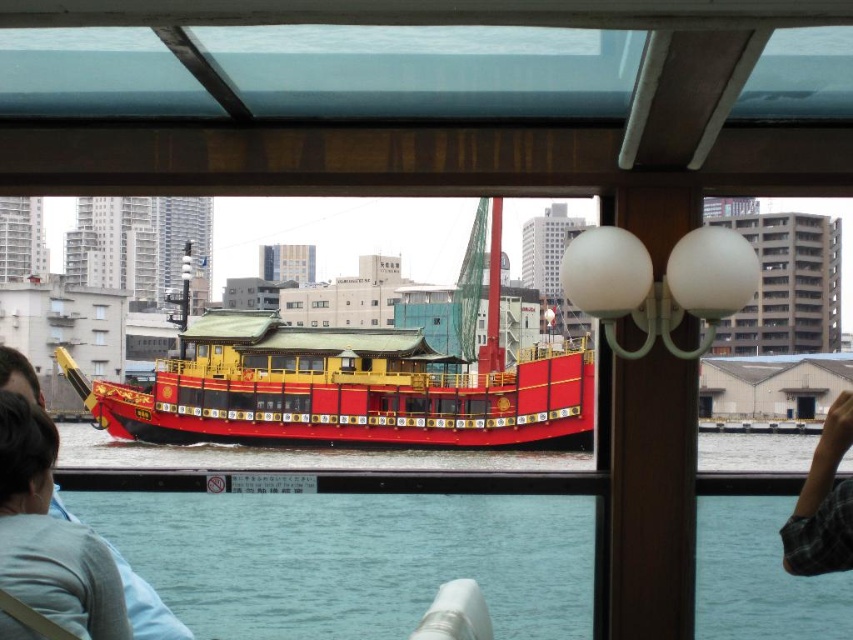
Looking at this image, you are inside the boat and want to reach the plaid fabric sleeve at lower right. Based on its coordinates, is it closer to the window or the interior wall?

The plaid fabric sleeve at lower right is located at point 0.786 on the x and 0.966 on the y, which places it closer to the interior wall since the coordinates are near the lower right corner of the image.